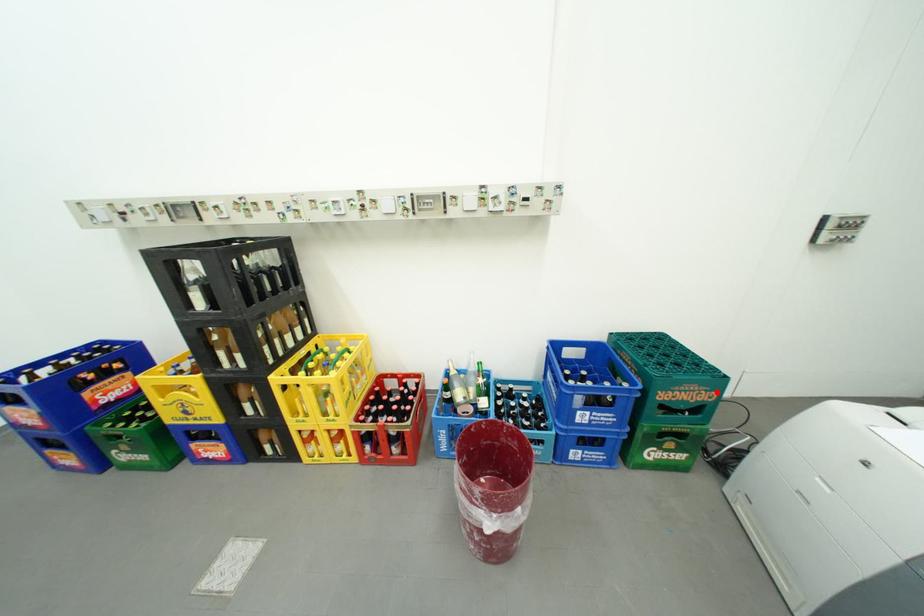
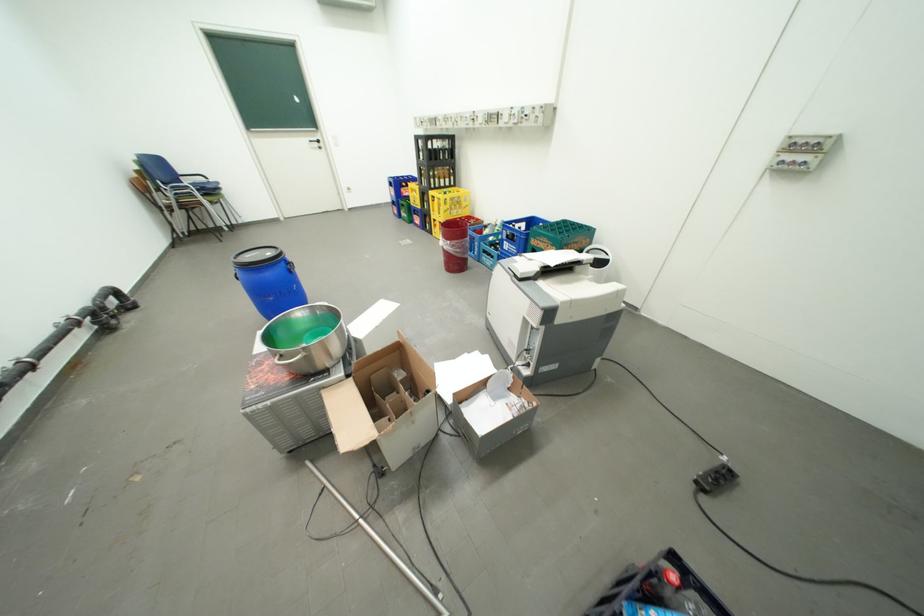
Find the pixel in the second image that matches the highlighted location in the first image.

(562, 246)